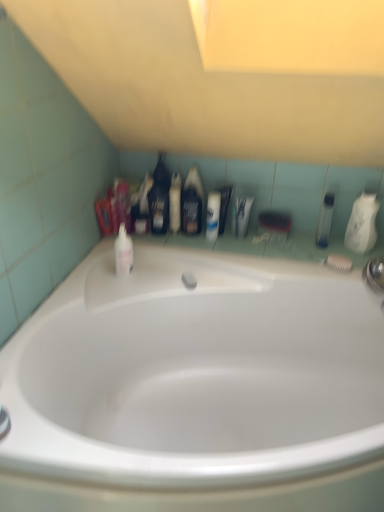
This screenshot has width=384, height=512. What do you see at coordinates (242, 215) in the screenshot?
I see `white glossy toothpaste tube at center, which is the 3th toiletry in left-to-right order` at bounding box center [242, 215].

You are a GUI agent. You are given a task and a screenshot of the screen. Output one action in this format:
    pyautogui.click(x=<x>, y=<y>)
    Task: Click on the black matte bottle at center, positioned as the third mouthwash in left-to-right order
    
    Given the screenshot: What is the action you would take?
    pyautogui.click(x=191, y=211)

Identify the location of white glossy mouthwash at upper right, positioned as the fifth mouthwash in left-to-right order. (362, 223).

This screenshot has height=512, width=384. Find the location of `clear plastic bottle at right, which is counted as the 2th mouthwash, starting from the right`. clear plastic bottle at right, which is counted as the 2th mouthwash, starting from the right is located at coordinates (325, 220).

Where is `pink glossy mouthwash at upper left, which is counted as the 1th mouthwash, starting from the left`? This screenshot has width=384, height=512. pink glossy mouthwash at upper left, which is counted as the 1th mouthwash, starting from the left is located at coordinates (123, 252).

Where is `black plastic bottle at center, the 3th toiletry viewed from the right`? The height and width of the screenshot is (512, 384). black plastic bottle at center, the 3th toiletry viewed from the right is located at coordinates (159, 198).

Image resolution: width=384 pixels, height=512 pixels. What do you see at coordinates (175, 202) in the screenshot? I see `translucent plastic mouthwash at upper center, the 2th mouthwash positioned from the left` at bounding box center [175, 202].

Image resolution: width=384 pixels, height=512 pixels. In order to click on white glossy toothpaste tube at center, the 1th toiletry from the right in this screenshot , I will do `click(242, 215)`.

Which is farther from the camera, (213, 229) or (184, 199)?

The point (184, 199) is farther.

Choose the correct answer: Is white glossy lotion at center, the second toiletry viewed from the right, inside black matte bottle at center, positioned as the third mouthwash in left-to-right order, or outside it?

white glossy lotion at center, the second toiletry viewed from the right, lies outside black matte bottle at center, positioned as the third mouthwash in left-to-right order.

Which of these two, white glossy lotion at center, the second toiletry viewed from the right, or black matte bottle at center, which ranks as the 3th mouthwash in right-to-left order, is smaller?

white glossy lotion at center, the second toiletry viewed from the right.

Which of these two, white glossy bathtub at center or white glossy toothpaste tube at center, which is the 3th toiletry in left-to-right order, stands taller?

Standing taller between the two is white glossy bathtub at center.

Is there a large distance between white glossy bathtub at center and white glossy toothpaste tube at center, the 1th toiletry from the right?

No, white glossy bathtub at center is not far away from white glossy toothpaste tube at center, the 1th toiletry from the right.

From the picture: Considering the sizes of objects white glossy bathtub at center and white glossy toothpaste tube at center, which is the 3th toiletry in left-to-right order, in the image provided, who is thinner, white glossy bathtub at center or white glossy toothpaste tube at center, which is the 3th toiletry in left-to-right order,?

white glossy toothpaste tube at center, which is the 3th toiletry in left-to-right order.

Is white glossy bathtub at center bigger or smaller than white glossy toothpaste tube at center, the 1th toiletry from the right?

Clearly, white glossy bathtub at center is larger in size than white glossy toothpaste tube at center, the 1th toiletry from the right.

Is white glossy mouthwash at upper right, positioned as the fifth mouthwash in left-to-right order, inside or outside of black matte bottle at center, which ranks as the 3th mouthwash in right-to-left order?

white glossy mouthwash at upper right, positioned as the fifth mouthwash in left-to-right order, is not inside black matte bottle at center, which ranks as the 3th mouthwash in right-to-left order, it's outside.

Which is more to the left, white glossy mouthwash at upper right, positioned as the fifth mouthwash in left-to-right order, or black matte bottle at center, which ranks as the 3th mouthwash in right-to-left order?

black matte bottle at center, which ranks as the 3th mouthwash in right-to-left order, is more to the left.

How much distance is there between white glossy mouthwash at upper right, positioned as the fifth mouthwash in left-to-right order, and black matte bottle at center, positioned as the third mouthwash in left-to-right order?

white glossy mouthwash at upper right, positioned as the fifth mouthwash in left-to-right order, is 25.57 inches from black matte bottle at center, positioned as the third mouthwash in left-to-right order.

Locate an element on the screen. The image size is (384, 512). the 2nd mouthwash in front of the clear plastic bottle at right, which is counted as the 2th mouthwash, starting from the right is located at coordinates (123, 252).

Does point (320, 229) come in front of point (121, 240)?

No, it is not.

Could you tell me if clear plastic bottle at right, which is counted as the 2th mouthwash, starting from the right, is facing pink glossy mouthwash at upper left, acting as the fifth mouthwash starting from the right?

No, clear plastic bottle at right, which is counted as the 2th mouthwash, starting from the right, does not turn towards pink glossy mouthwash at upper left, acting as the fifth mouthwash starting from the right.

Based on the photo, considering the relative sizes of black matte bottle at center, positioned as the third mouthwash in left-to-right order, and clear plastic bottle at right, which is counted as the 2th mouthwash, starting from the right, in the image provided, is black matte bottle at center, positioned as the third mouthwash in left-to-right order, wider than clear plastic bottle at right, which is counted as the 2th mouthwash, starting from the right,?

Indeed, black matte bottle at center, positioned as the third mouthwash in left-to-right order, has a greater width compared to clear plastic bottle at right, which is counted as the 2th mouthwash, starting from the right.

Is point (196, 232) positioned before point (326, 202)?

That is False.

Is black matte bottle at center, positioned as the third mouthwash in left-to-right order, far from clear plastic bottle at right, arranged as the fourth mouthwash when viewed from the left?

No, there isn't a large distance between black matte bottle at center, positioned as the third mouthwash in left-to-right order, and clear plastic bottle at right, arranged as the fourth mouthwash when viewed from the left.

Locate an element on the screen. Image resolution: width=384 pixels, height=512 pixels. the 1st mouthwash to the right of the black matte bottle at center, which ranks as the 3th mouthwash in right-to-left order, counting from the anchor's position is located at coordinates (325, 220).

From the image's perspective, count 3rd toiletrys upward from the pink glossy mouthwash at upper left, acting as the fifth mouthwash starting from the right, and point to it. Please provide its 2D coordinates.

[(159, 198)]

Is point (120, 250) closer to camera compared to point (165, 217)?

That is True.

Is pink glossy mouthwash at upper left, acting as the fifth mouthwash starting from the right, turned away from black plastic bottle at center, the 3th toiletry viewed from the right?

Yes, pink glossy mouthwash at upper left, acting as the fifth mouthwash starting from the right, is positioned with its back facing black plastic bottle at center, the 3th toiletry viewed from the right.

Do you think translucent plastic mouthwash at upper center, which ranks as the fourth mouthwash in right-to-left order, is within white glossy bathtub at center, or outside of it?

translucent plastic mouthwash at upper center, which ranks as the fourth mouthwash in right-to-left order, is outside white glossy bathtub at center.

Does translucent plastic mouthwash at upper center, which ranks as the fourth mouthwash in right-to-left order, have a greater width compared to white glossy bathtub at center?

No, translucent plastic mouthwash at upper center, which ranks as the fourth mouthwash in right-to-left order, is not wider than white glossy bathtub at center.

Is translucent plastic mouthwash at upper center, which ranks as the fourth mouthwash in right-to-left order, touching white glossy bathtub at center?

translucent plastic mouthwash at upper center, which ranks as the fourth mouthwash in right-to-left order, and white glossy bathtub at center are clearly separated.

Considering the positions of objects translucent plastic mouthwash at upper center, the 2th mouthwash positioned from the left, and white glossy bathtub at center in the image provided, who is in front, translucent plastic mouthwash at upper center, the 2th mouthwash positioned from the left, or white glossy bathtub at center?

white glossy bathtub at center.

From a real-world perspective, count 1st mouthwashs upward from the white glossy lotion at center, the second toiletry viewed from the right, and point to it. Please provide its 2D coordinates.

[(191, 211)]

The height and width of the screenshot is (512, 384). I want to click on bathtub in front of the white glossy toothpaste tube at center, which is the 3th toiletry in left-to-right order, so click(196, 388).

From the image, which object appears to be farther from black matte bottle at center, positioned as the third mouthwash in left-to-right order, white glossy lotion at center, which is the 2th toiletry in left-to-right order, or white glossy mouthwash at upper right, positioned as the first mouthwash in right-to-left order?

white glossy mouthwash at upper right, positioned as the first mouthwash in right-to-left order, lies further to black matte bottle at center, positioned as the third mouthwash in left-to-right order, than the other object.

Based on their spatial positions, is black matte bottle at center, positioned as the third mouthwash in left-to-right order, or black plastic bottle at center, the 3th toiletry viewed from the right, further from white glossy toothpaste tube at center, which is the 3th toiletry in left-to-right order?

Based on the image, black plastic bottle at center, the 3th toiletry viewed from the right, appears to be further to white glossy toothpaste tube at center, which is the 3th toiletry in left-to-right order.

From the image, which object appears to be farther from black matte bottle at center, positioned as the third mouthwash in left-to-right order, white glossy lotion at center, the second toiletry viewed from the right, or clear plastic bottle at right, arranged as the fourth mouthwash when viewed from the left?

Based on the image, clear plastic bottle at right, arranged as the fourth mouthwash when viewed from the left, appears to be further to black matte bottle at center, positioned as the third mouthwash in left-to-right order.

When comparing their distances from white glossy lotion at center, which is the 2th toiletry in left-to-right order, does white glossy toothpaste tube at center, which is the 3th toiletry in left-to-right order, or white glossy mouthwash at upper right, positioned as the first mouthwash in right-to-left order, seem closer?

Based on the image, white glossy toothpaste tube at center, which is the 3th toiletry in left-to-right order, appears to be nearer to white glossy lotion at center, which is the 2th toiletry in left-to-right order.

Based on their spatial positions, is black plastic bottle at center, the 3th toiletry viewed from the right, or pink glossy mouthwash at upper left, acting as the fifth mouthwash starting from the right, further from black matte bottle at center, positioned as the third mouthwash in left-to-right order?

The object further to black matte bottle at center, positioned as the third mouthwash in left-to-right order, is pink glossy mouthwash at upper left, acting as the fifth mouthwash starting from the right.

Looking at the image, which one is located closer to black matte bottle at center, which ranks as the 3th mouthwash in right-to-left order, black plastic bottle at center, which is the 1th toiletry from left to right, or clear plastic bottle at right, which is counted as the 2th mouthwash, starting from the right?

black plastic bottle at center, which is the 1th toiletry from left to right, is closer to black matte bottle at center, which ranks as the 3th mouthwash in right-to-left order.

When comparing their distances from black matte bottle at center, which ranks as the 3th mouthwash in right-to-left order, does pink glossy mouthwash at upper left, which is counted as the 1th mouthwash, starting from the left, or white glossy toothpaste tube at center, which is the 3th toiletry in left-to-right order, seem further?

pink glossy mouthwash at upper left, which is counted as the 1th mouthwash, starting from the left.

Which object lies nearer to the anchor point black matte bottle at center, which ranks as the 3th mouthwash in right-to-left order, clear plastic bottle at right, arranged as the fourth mouthwash when viewed from the left, or white glossy mouthwash at upper right, positioned as the fifth mouthwash in left-to-right order?

Based on the image, clear plastic bottle at right, arranged as the fourth mouthwash when viewed from the left, appears to be nearer to black matte bottle at center, which ranks as the 3th mouthwash in right-to-left order.

Locate an element on the screen. This screenshot has width=384, height=512. toiletry located between black plastic bottle at center, which is the 1th toiletry from left to right, and white glossy toothpaste tube at center, the 1th toiletry from the right, in the left-right direction is located at coordinates (213, 215).

At what (x,y) coordinates should I click in order to perform the action: click on toiletry located between black matte bottle at center, which ranks as the 3th mouthwash in right-to-left order, and white glossy toothpaste tube at center, the 1th toiletry from the right, in the left-right direction. Please return your answer as a coordinate pair (x, y). The image size is (384, 512). Looking at the image, I should click on (213, 215).

The width and height of the screenshot is (384, 512). In order to click on mouthwash between translucent plastic mouthwash at upper center, the 2th mouthwash positioned from the left, and white glossy toothpaste tube at center, which is the 3th toiletry in left-to-right order, from left to right in this screenshot , I will do `click(191, 211)`.

The image size is (384, 512). What are the coordinates of `mouthwash situated between translucent plastic mouthwash at upper center, which ranks as the fourth mouthwash in right-to-left order, and white glossy lotion at center, which is the 2th toiletry in left-to-right order, from left to right` in the screenshot? It's located at (191, 211).